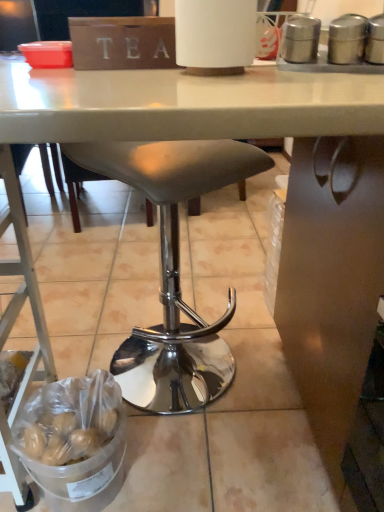
Identify the location of free space in front of matte gray stool at center. Image resolution: width=384 pixels, height=512 pixels. (218, 451).